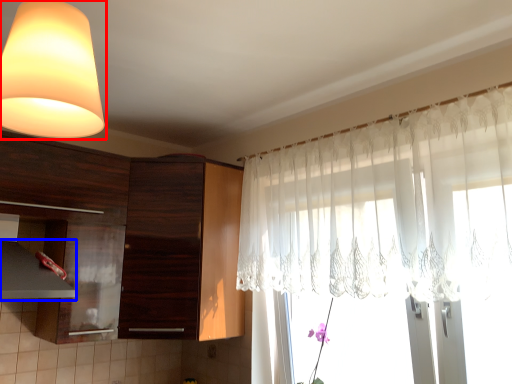
Question: Which point is closer to the camera, lamp (highlighted by a red box) or exhaust hood (highlighted by a blue box)?

Choices:
 (A) lamp
 (B) exhaust hood

Answer: (A)